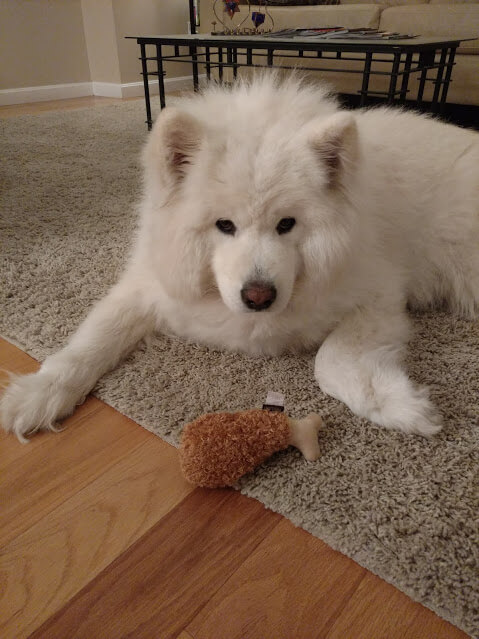
This screenshot has width=479, height=639. What are the coordinates of `photo of room inside of house` in the screenshot? It's located at (86, 79).